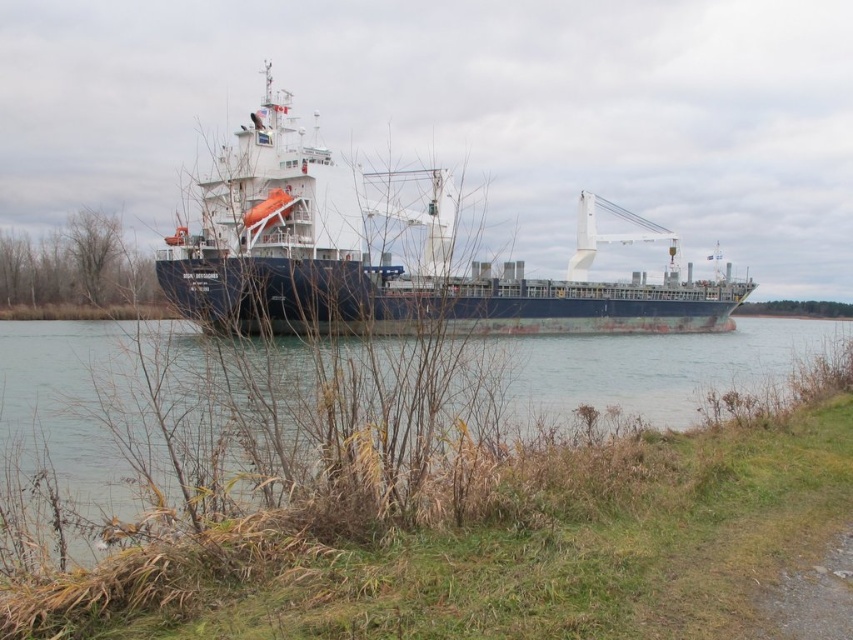
You are a photographer trying to capture the blue matte cargo ship at center and the dark blue water at center in a single frame. Based on their sizes, which object should you focus on first to ensure both are in the frame?

The blue matte cargo ship at center is larger than the dark blue water at center, so focusing on the ship first will help ensure both fit within the frame.